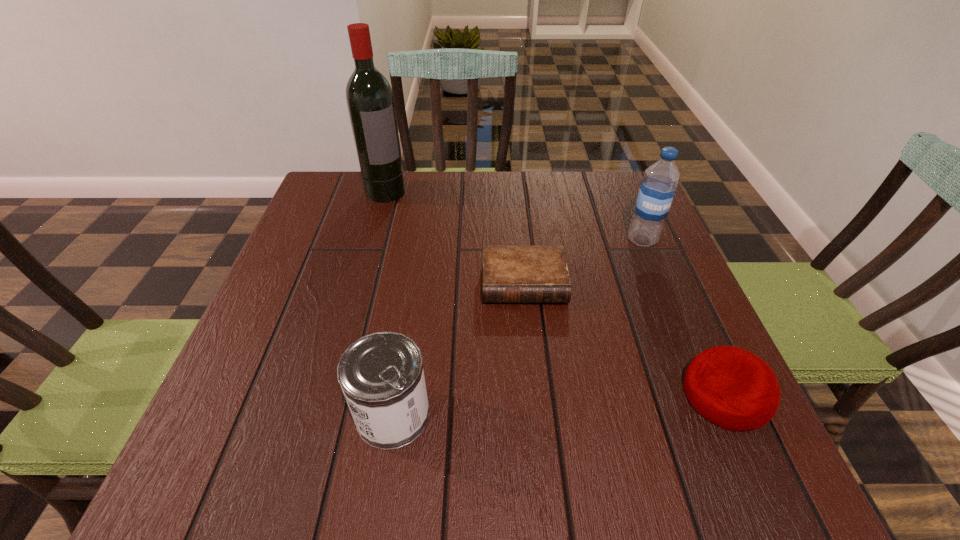
You are a GUI agent. You are given a task and a screenshot of the screen. Output one action in this format:
    pyautogui.click(x=<x>, y=<y>)
    Task: Click on the free spot on the desktop that is between the can and the beanbag and is positioned on the spine side of the third object from left to right
    
    Given the screenshot: What is the action you would take?
    pos(535,406)

Locate an element on the screen. vacant space on the desktop that is between the third shortest object and the beanbag and is positioned on the label of the farthest object is located at coordinates (542, 406).

The width and height of the screenshot is (960, 540). Identify the location of vacant spot on the desktop that is between the can and the beanbag and is positioned on the label of the second tallest object. (531, 406).